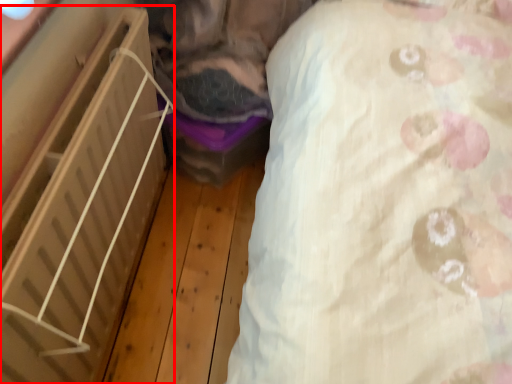
Question: Where is furniture (annotated by the red box) located in relation to sheet in the image?

Choices:
 (A) left
 (B) right

Answer: (A)